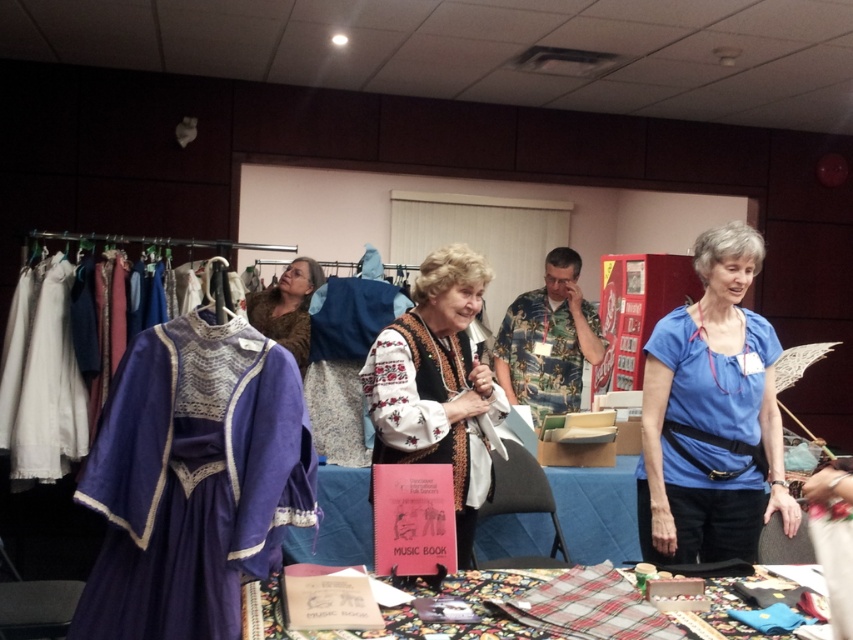
Who is positioned more to the left, purple satin dress at left or embroidered fabric vest at center?

purple satin dress at left

Does purple satin dress at left have a larger size compared to embroidered fabric vest at center?

No.

Where is `purple satin dress at left`? This screenshot has height=640, width=853. purple satin dress at left is located at coordinates (193, 481).

You are a GUI agent. You are given a task and a screenshot of the screen. Output one action in this format:
    pyautogui.click(x=<x>, y=<y>)
    Task: Click on the purple satin dress at left
    This screenshot has width=853, height=640.
    Given the screenshot: What is the action you would take?
    coord(193,481)

Looking at this image, is purple satin dress at left shorter than camouflage fabric shirt at center?

Yes.

Between point (195, 321) and point (558, 324), which one is positioned in front?

Positioned in front is point (195, 321).

The height and width of the screenshot is (640, 853). Find the location of `purple satin dress at left`. purple satin dress at left is located at coordinates (193, 481).

Is flannel fabric at lower center further to the viewer compared to fuzzy brown scarf at center?

No, flannel fabric at lower center is closer to the viewer.

Find the location of a particular element. This screenshot has width=853, height=640. flannel fabric at lower center is located at coordinates (469, 605).

Who is more forward, (492, 596) or (286, 348)?

Point (492, 596) is in front.

The image size is (853, 640). I want to click on flannel fabric at lower center, so click(469, 605).